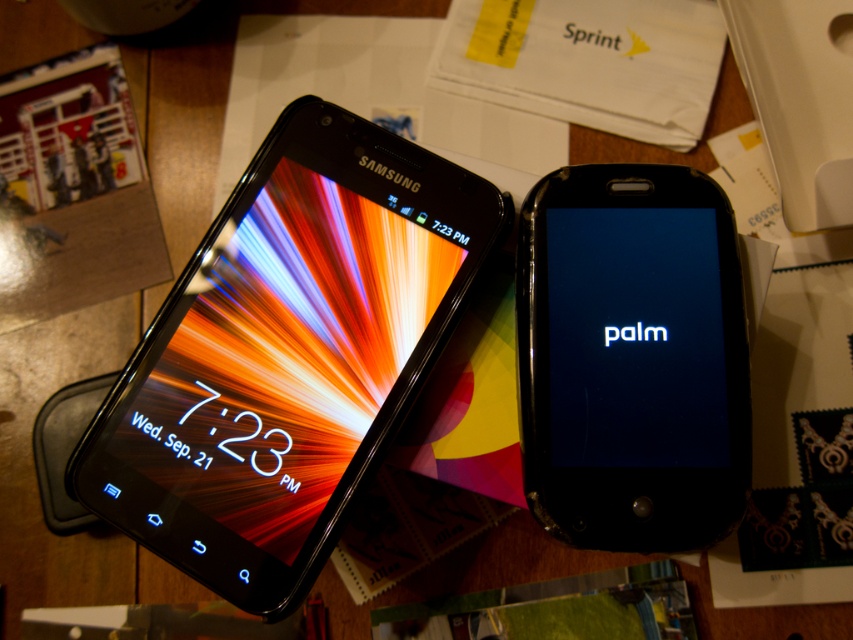
Consider the image. Who is more forward, (341, 260) or (611, 440)?

Point (611, 440) is more forward.

Can you confirm if matte black smartphone at center is wider than black glossy phone at center?

Yes, matte black smartphone at center is wider than black glossy phone at center.

At what (x,y) coordinates should I click in order to perform the action: click on matte black smartphone at center. Please return your answer as a coordinate pair (x, y). Looking at the image, I should click on (287, 355).